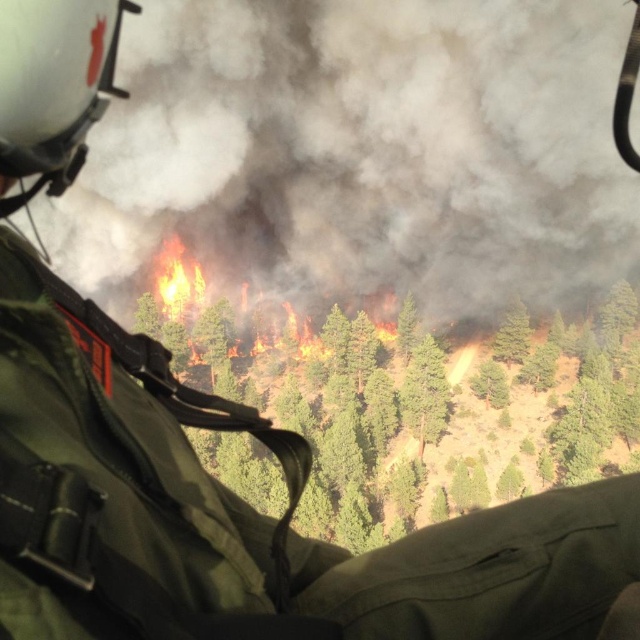
Question: Is white matte helmet at upper left wider than flaming orange fire at center?

Choices:
 (A) no
 (B) yes

Answer: (A)

Question: Which object is farther from the camera taking this photo?

Choices:
 (A) flaming orange fire at center
 (B) white matte helmet at upper left

Answer: (A)

Question: Does white matte helmet at upper left have a greater width compared to flaming orange fire at center?

Choices:
 (A) yes
 (B) no

Answer: (B)

Question: Among these points, which one is farthest from the camera?

Choices:
 (A) (172, 243)
 (B) (20, 177)

Answer: (A)

Question: Does white matte helmet at upper left have a lesser width compared to flaming orange fire at center?

Choices:
 (A) yes
 (B) no

Answer: (A)